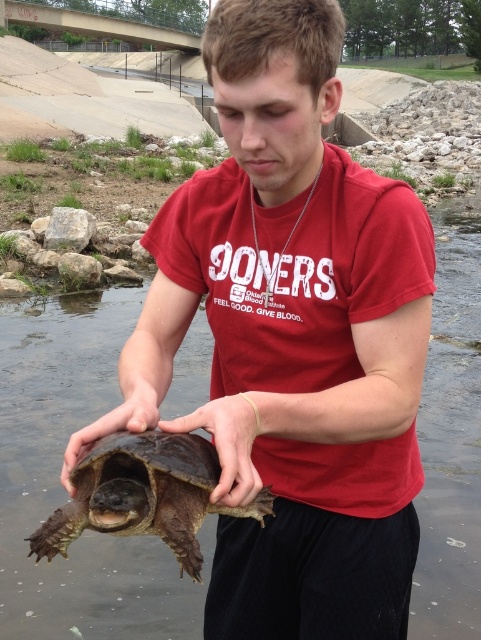
Can you confirm if brown rough turtle at center is bigger than brown rough tortoise at center?

Yes.

Consider the image. Which of these two, brown rough turtle at center or brown rough tortoise at center, stands taller?

With more height is brown rough turtle at center.

Which is in front, point (456, 538) or point (89, 483)?

Positioned in front is point (89, 483).

Locate an element on the screen. brown rough turtle at center is located at coordinates (63, 490).

Can you confirm if brown rough tortoise at center is thinner than matte brown turtle at center?

Incorrect, brown rough tortoise at center's width is not less than matte brown turtle at center's.

Between point (135, 467) and point (117, 412), which one is positioned behind?

The point (117, 412) is more distant.

Is point (39, 538) farther from viewer compared to point (121, 412)?

No, it is in front of (121, 412).

Identify the location of brown rough tortoise at center. This screenshot has width=481, height=640. (143, 496).

Is brown rough tortoise at center to the right of brown rough skin at center from the viewer's perspective?

Incorrect, brown rough tortoise at center is not on the right side of brown rough skin at center.

Image resolution: width=481 pixels, height=640 pixels. Describe the element at coordinates (143, 496) in the screenshot. I see `brown rough tortoise at center` at that location.

The image size is (481, 640). I want to click on brown rough tortoise at center, so click(x=143, y=496).